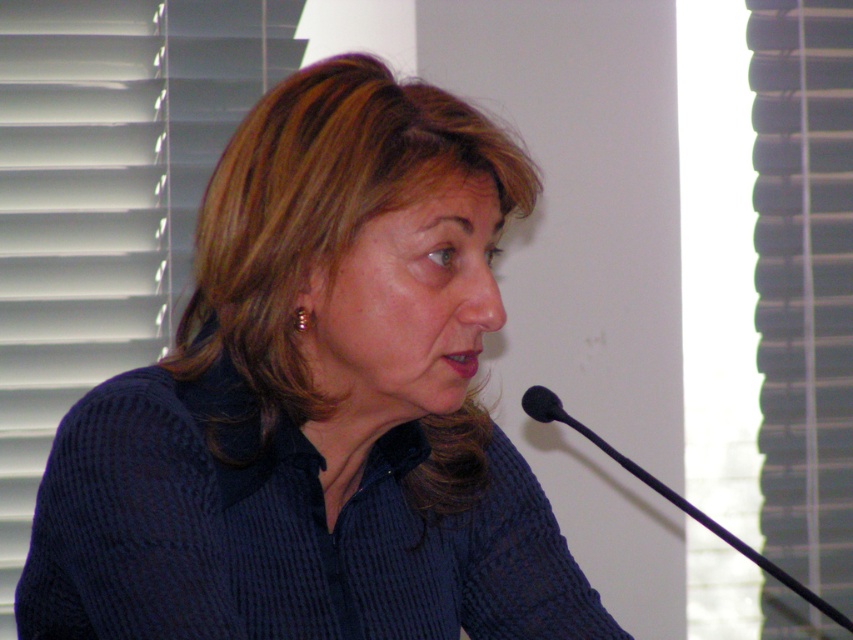
Question: Which point appears farthest from the camera in this image?

Choices:
 (A) coord(485,557)
 (B) coord(775,625)

Answer: (B)

Question: Is dark blue textured shirt at center to the right of black matte microphone at lower right from the viewer's perspective?

Choices:
 (A) no
 (B) yes

Answer: (A)

Question: Which object is positioned closest to the black matte microphone at lower right?

Choices:
 (A) black plastic microphone at lower right
 (B) dark blue textured shirt at center
 (C) white plastic blinds at right
 (D) white matte blinds at left

Answer: (C)

Question: Is black matte microphone at lower right thinner than black plastic microphone at lower right?

Choices:
 (A) no
 (B) yes

Answer: (A)

Question: Which point appears closest to the camera in this image?

Choices:
 (A) (18, 250)
 (B) (532, 413)
 (C) (151, 372)

Answer: (C)

Question: Does dark blue textured shirt at center appear on the left side of black plastic microphone at lower right?

Choices:
 (A) no
 (B) yes

Answer: (B)